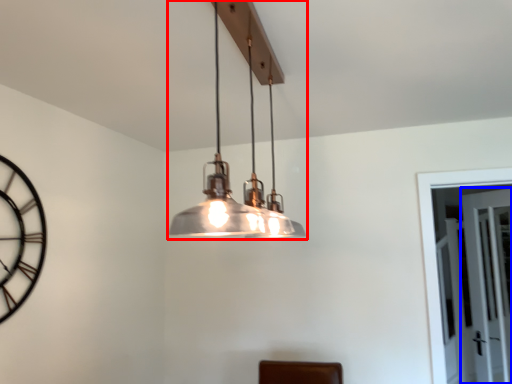
Question: Which point is further to the camera, lamp (highlighted by a red box) or glass door (highlighted by a blue box)?

Choices:
 (A) lamp
 (B) glass door

Answer: (B)